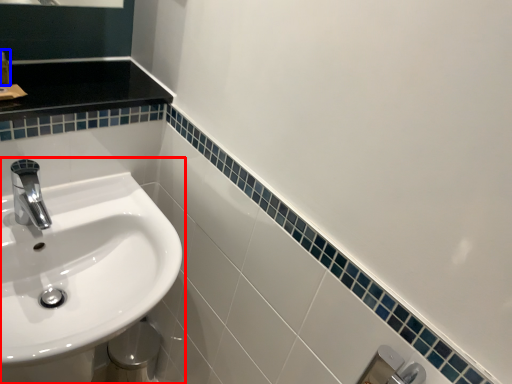
Question: Which of the following is the farthest to the observer, sink (highlighted by a red box) or toiletry (highlighted by a blue box)?

Choices:
 (A) sink
 (B) toiletry

Answer: (B)